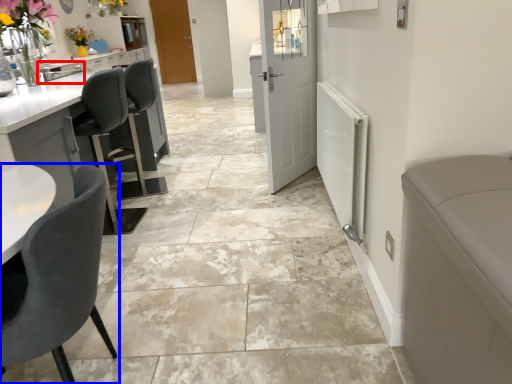
Question: Which object appears closest to the camera in this image, sink (highlighted by a red box) or chair (highlighted by a blue box)?

Choices:
 (A) sink
 (B) chair

Answer: (B)